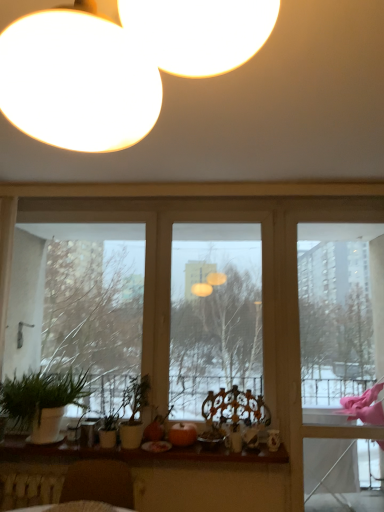
Measure the distance between point (90, 506) and camera.

Point (90, 506) is 7.97 feet away from camera.

Describe the element at coordinates (133, 453) in the screenshot. I see `wooden at lower center` at that location.

Find the location of a particular element. pink fabric at right is located at coordinates tap(339, 357).

What do you see at coordinates (214, 315) in the screenshot? I see `green matte plant at lower left` at bounding box center [214, 315].

I want to click on green matte plant at center, which ranks as the first houseplant in right-to-left order, so click(x=134, y=411).

From the image's perspective, relative to wooden at lower center, is green matte plant at lower left, the 2th houseplant from the right, above or below?

green matte plant at lower left, the 2th houseplant from the right, is above wooden at lower center.

Considering the positions of points (58, 379) and (169, 452), is point (58, 379) closer to camera compared to point (169, 452)?

No, it is behind (169, 452).

Based on the photo, can you confirm if green matte plant at lower left, which is the 1th houseplant in left-to-right order, is taller than wooden at lower center?

Yes.

Does green matte plant at lower left, the 2th houseplant from the right, have a lesser width compared to wooden at lower center?

No, green matte plant at lower left, the 2th houseplant from the right, is not thinner than wooden at lower center.

How different are the orientations of pink fabric at right and brown leather swivel chair at lower left in degrees?

5.38 degrees.

Is pink fabric at right not within brown leather swivel chair at lower left?

Yes, pink fabric at right is not within brown leather swivel chair at lower left.

Which is behind, point (334, 490) or point (66, 498)?

The point (334, 490) is farther from the camera.

Considering the sizes of pink fabric at right and brown leather swivel chair at lower left in the image, is pink fabric at right bigger or smaller than brown leather swivel chair at lower left?

Considering their sizes, pink fabric at right takes up more space than brown leather swivel chair at lower left.

What's the angular difference between green matte plant at lower left, the 2th houseplant from the right, and brown leather swivel chair at lower left's facing directions?

green matte plant at lower left, the 2th houseplant from the right, and brown leather swivel chair at lower left are facing 5.38 degrees away from each other.

From their relative heights in the image, would you say green matte plant at lower left, the 2th houseplant from the right, is taller or shorter than brown leather swivel chair at lower left?

In the image, green matte plant at lower left, the 2th houseplant from the right, appears to be taller than brown leather swivel chair at lower left.

Is green matte plant at lower left, which is the 1th houseplant in left-to-right order, positioned far away from brown leather swivel chair at lower left?

They are positioned close to each other.

Locate an element on the screen. Image resolution: width=384 pixels, height=512 pixels. houseplant lying on the left of brown leather swivel chair at lower left is located at coordinates (42, 401).

Is pink fabric at right at the left side of wooden round table at lower left?

Incorrect, pink fabric at right is not on the left side of wooden round table at lower left.

In terms of width, does pink fabric at right look wider or thinner when compared to wooden round table at lower left?

Clearly, pink fabric at right has less width compared to wooden round table at lower left.

Considering the positions of point (343, 398) and point (32, 507), is point (343, 398) closer or farther from the camera than point (32, 507)?

Point (343, 398) appears to be farther away from the viewer than point (32, 507).

From their relative heights in the image, would you say pink fabric at right is taller or shorter than green matte plant at center, which ranks as the first houseplant in right-to-left order?

In the image, pink fabric at right appears to be taller than green matte plant at center, which ranks as the first houseplant in right-to-left order.

Is point (307, 508) behind point (138, 433)?

Yes, it is behind point (138, 433).

Does pink fabric at right have a lesser width compared to green matte plant at center, which is counted as the second houseplant, starting from the left?

Indeed, pink fabric at right has a lesser width compared to green matte plant at center, which is counted as the second houseplant, starting from the left.

Is pink fabric at right facing away from green matte plant at center, which is counted as the second houseplant, starting from the left?

No, green matte plant at center, which is counted as the second houseplant, starting from the left, is not at the back of pink fabric at right.

Is green matte plant at lower left, which is the 1th houseplant in left-to-right order, bigger or smaller than wooden round table at lower left?

Considering their sizes, green matte plant at lower left, which is the 1th houseplant in left-to-right order, takes up more space than wooden round table at lower left.

Locate an element on the screen. Image resolution: width=384 pixels, height=512 pixels. round table on the right side of green matte plant at lower left, the 2th houseplant from the right is located at coordinates (73, 507).

Which is behind, green matte plant at lower left, the 2th houseplant from the right, or wooden round table at lower left?

green matte plant at lower left, the 2th houseplant from the right, is further away from the camera.

Is green matte plant at lower left, which is the 1th houseplant in left-to-right order, taller than wooden round table at lower left?

Yes.

Considering the positions of objects green matte plant at lower left, which is the 1th houseplant in left-to-right order, and green matte plant at center, which is counted as the second houseplant, starting from the left, in the image provided, who is more to the right, green matte plant at lower left, which is the 1th houseplant in left-to-right order, or green matte plant at center, which is counted as the second houseplant, starting from the left,?

green matte plant at center, which is counted as the second houseplant, starting from the left.

Is green matte plant at lower left, which is the 1th houseplant in left-to-right order, looking in the opposite direction of green matte plant at center, which is counted as the second houseplant, starting from the left?

That's not correct — green matte plant at lower left, which is the 1th houseplant in left-to-right order, is not looking away from green matte plant at center, which is counted as the second houseplant, starting from the left.

Based on the photo, is green matte plant at lower left, which is the 1th houseplant in left-to-right order, smaller than green matte plant at center, which ranks as the first houseplant in right-to-left order?

No, green matte plant at lower left, which is the 1th houseplant in left-to-right order, is not smaller than green matte plant at center, which ranks as the first houseplant in right-to-left order.

Is green matte plant at lower left, the 2th houseplant from the right, not close to green matte plant at center, which ranks as the first houseplant in right-to-left order?

green matte plant at lower left, the 2th houseplant from the right, is near green matte plant at center, which ranks as the first houseplant in right-to-left order, not far away.

At what (x,y) coordinates should I click in order to perform the action: click on houseplant in front of the wooden at lower center. Please return your answer as a coordinate pair (x, y). This screenshot has width=384, height=512. Looking at the image, I should click on click(x=42, y=401).

Identify the location of screen door that is on the right side of brown leather swivel chair at lower left. The width and height of the screenshot is (384, 512). (339, 357).

Looking at the image, which one is located closer to green matte plant at lower left, the 2th houseplant from the right, green matte plant at center, which ranks as the first houseplant in right-to-left order, or wooden at lower center?

Based on the image, wooden at lower center appears to be nearer to green matte plant at lower left, the 2th houseplant from the right.

Considering their positions, is wooden at lower center positioned closer to green matte plant at center, which is counted as the second houseplant, starting from the left, than green matte plant at lower left?

wooden at lower center.

Estimate the real-world distances between objects in this image. Which object is closer to wooden at lower center, wooden round table at lower left or brown leather swivel chair at lower left?

Among the two, brown leather swivel chair at lower left is located nearer to wooden at lower center.

Which object lies nearer to the anchor point green matte plant at center, which is counted as the second houseplant, starting from the left, green matte plant at lower left or brown leather swivel chair at lower left?

Among the two, brown leather swivel chair at lower left is located nearer to green matte plant at center, which is counted as the second houseplant, starting from the left.

Looking at this image, when comparing their distances from wooden round table at lower left, does green matte plant at lower left, which is the 1th houseplant in left-to-right order, or brown leather swivel chair at lower left seem closer?

brown leather swivel chair at lower left.

In the scene shown: From the image, which object appears to be farther from wooden at lower center, green matte plant at lower left, which is the 1th houseplant in left-to-right order, or green matte plant at center, which ranks as the first houseplant in right-to-left order?

Among the two, green matte plant at center, which ranks as the first houseplant in right-to-left order, is located further to wooden at lower center.

Considering their positions, is green matte plant at center, which ranks as the first houseplant in right-to-left order, positioned further to green matte plant at lower left than brown leather swivel chair at lower left?

brown leather swivel chair at lower left is further to green matte plant at lower left.

Estimate the real-world distances between objects in this image. Which object is closer to wooden round table at lower left, green matte plant at lower left, which is the 1th houseplant in left-to-right order, or pink fabric at right?

The object closer to wooden round table at lower left is green matte plant at lower left, which is the 1th houseplant in left-to-right order.

At what (x,y) coordinates should I click in order to perform the action: click on houseplant positioned between wooden round table at lower left and wooden at lower center from near to far. Please return your answer as a coordinate pair (x, y). Image resolution: width=384 pixels, height=512 pixels. Looking at the image, I should click on (42, 401).

I want to click on swivel chair located between green matte plant at lower left, the 2th houseplant from the right, and pink fabric at right in the left-right direction, so click(99, 483).

Identify the location of swivel chair between green matte plant at lower left, the 2th houseplant from the right, and green matte plant at center, which is counted as the second houseplant, starting from the left, from left to right. The image size is (384, 512). (99, 483).

You are a GUI agent. You are given a task and a screenshot of the screen. Output one action in this format:
    pyautogui.click(x=<x>, y=<y>)
    Task: Click on the round table between green matte plant at lower left, which is the 1th houseplant in left-to-right order, and pink fabric at right from left to right
    The width and height of the screenshot is (384, 512).
    Given the screenshot: What is the action you would take?
    pyautogui.click(x=73, y=507)